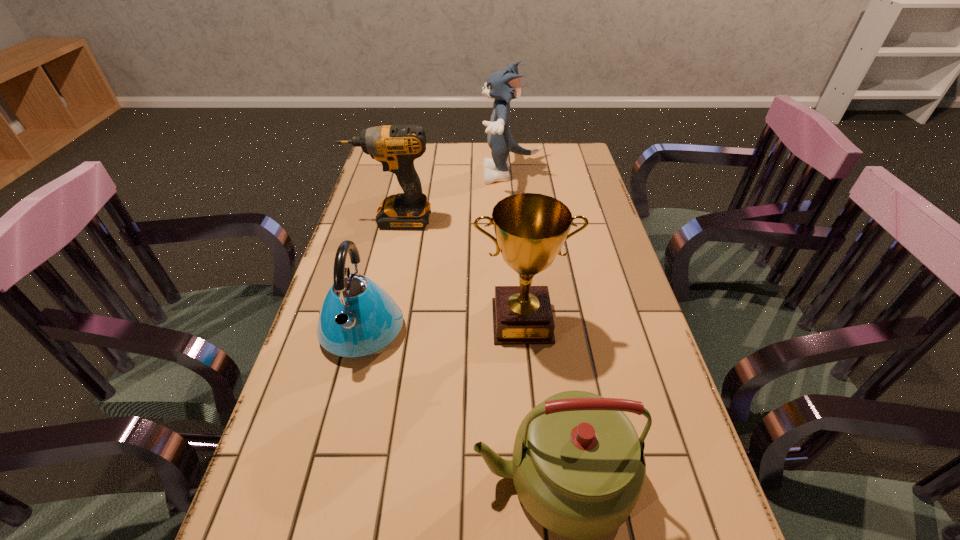
Identify which object is the third closest to the second farthest object. Please provide its 2D coordinates. Your answer should be formatted as a tuple, i.e. [(x, y)], where the tuple contains the x and y coordinates of a point satisfying the conditions above.

[(530, 229)]

Locate an element on the screen. Image resolution: width=960 pixels, height=540 pixels. vacant space that satisfies the following two spatial constraints: 1. with the drill bit of the drill facing forward; 2. at the spout of the farther kettle is located at coordinates (367, 328).